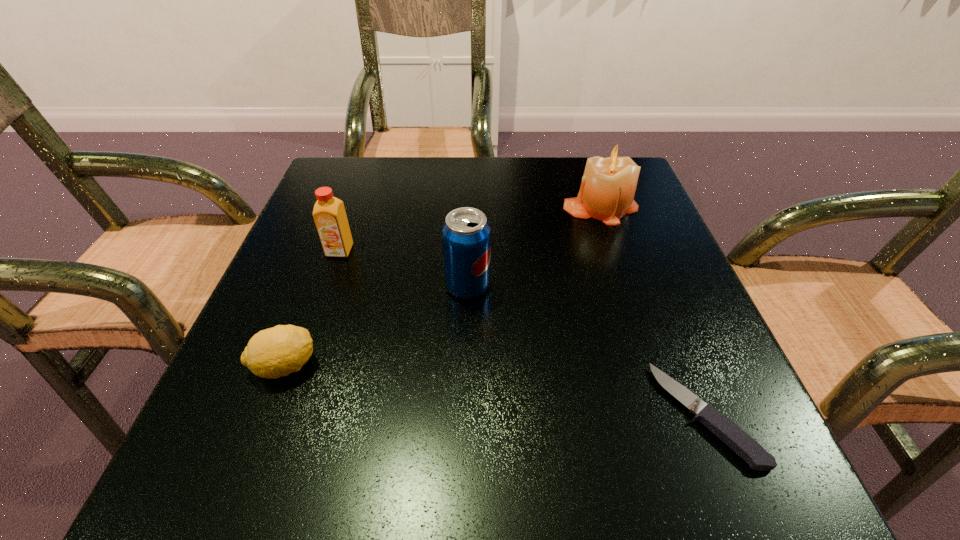
I want to click on free space located 0.140m on the back of the shortest object, so click(x=659, y=299).

In order to click on object that is at the far edge in this screenshot , I will do `click(608, 186)`.

I want to click on object present at the near edge, so click(x=726, y=430).

Find the location of a particular element. orange juice that is at the left edge is located at coordinates (329, 214).

Image resolution: width=960 pixels, height=540 pixels. I want to click on lemon that is at the left edge, so click(278, 351).

Identify the location of candle present at the right edge. The image size is (960, 540). (608, 186).

Identify the location of steak knife that is positioned at the right edge. The image size is (960, 540). (726, 430).

Where is `object present at the far right corner`? This screenshot has height=540, width=960. object present at the far right corner is located at coordinates (608, 186).

Locate an element on the screen. This screenshot has width=960, height=540. object positioned at the near right corner is located at coordinates (726, 430).

Image resolution: width=960 pixels, height=540 pixels. In order to click on vacant space at the far edge of the desktop in this screenshot , I will do `click(473, 194)`.